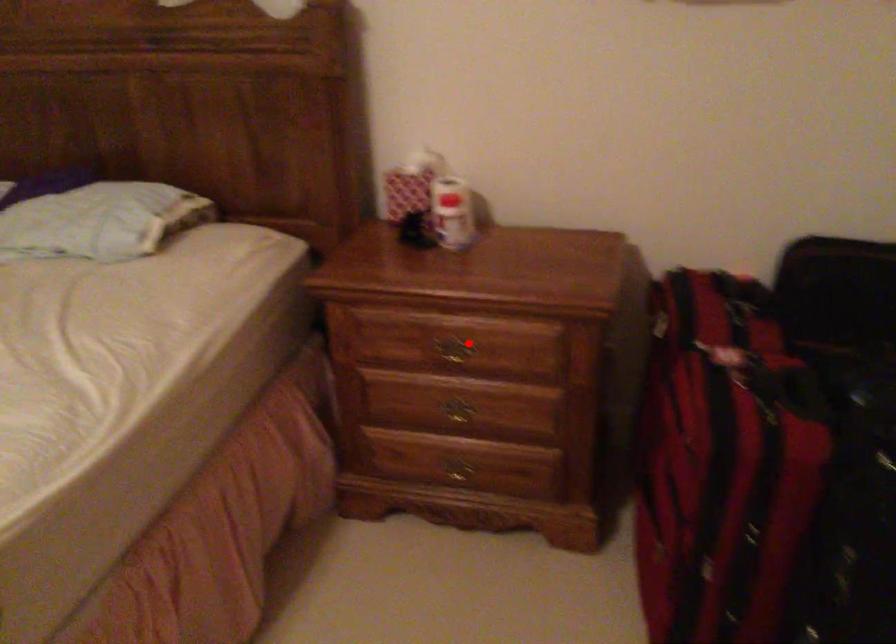
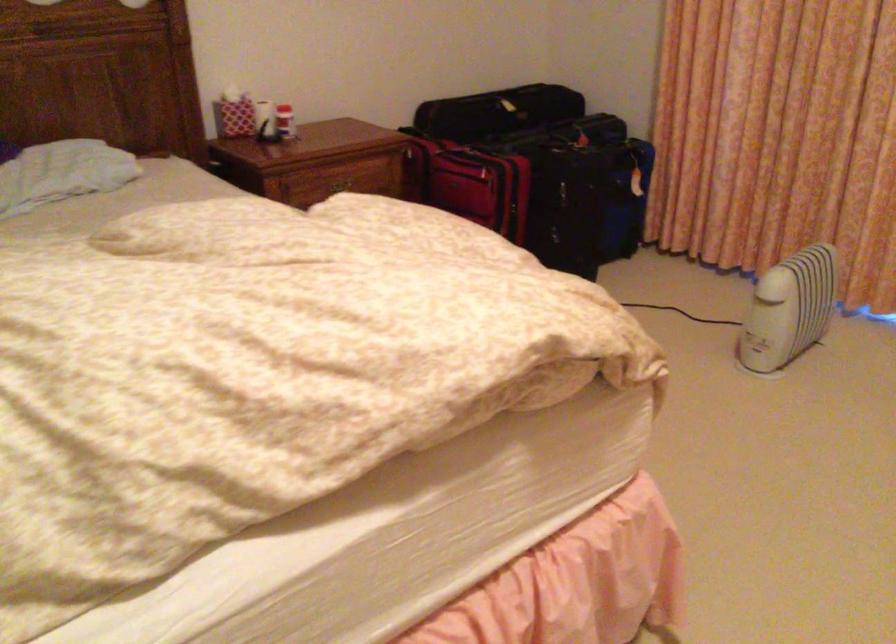
Question: I am providing you with two images of the same scene from different viewpoints. A red point is shown in image1. For the corresponding object point in image2, is it positioned nearer or farther from the camera?

Choices:
 (A) Nearer
 (B) Farther

Answer: (B)